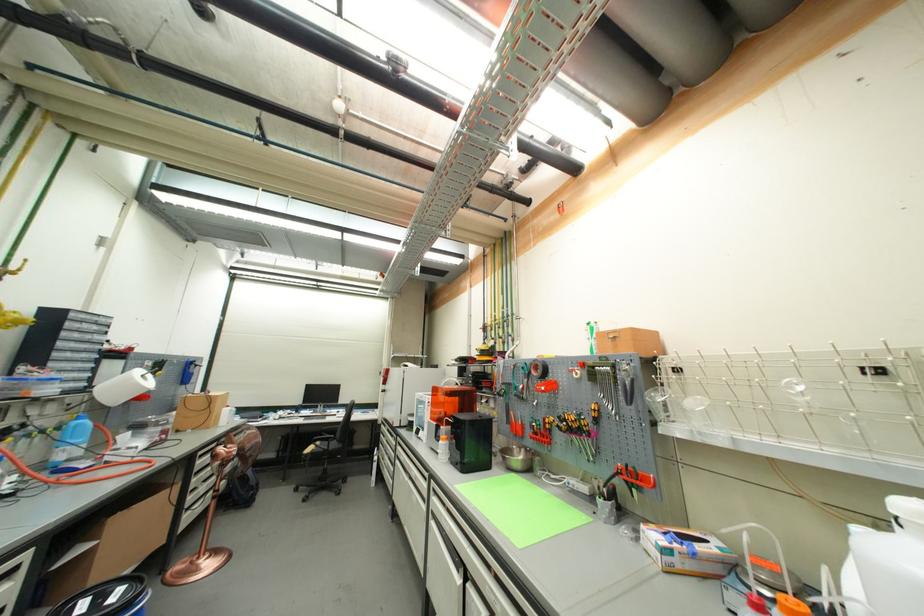
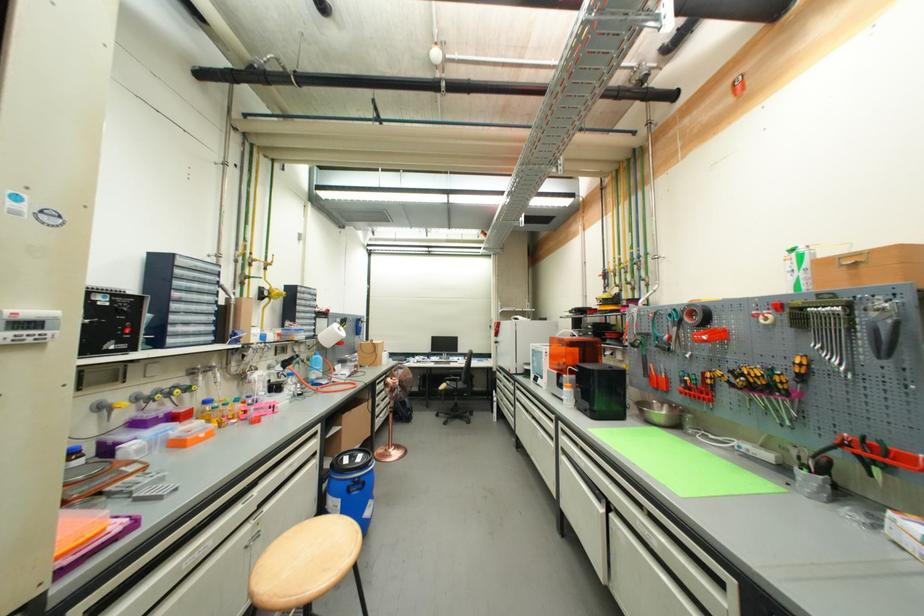
Question: How did the camera likely rotate?

Choices:
 (A) Left
 (B) Right
 (C) Up
 (D) Down

Answer: (A)